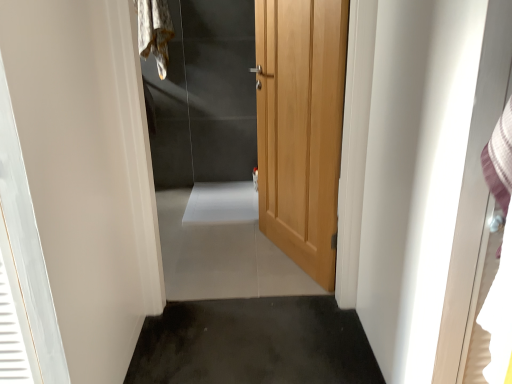
Question: From the image's perspective, is wooden door at center above or below light wood door at center?

Choices:
 (A) above
 (B) below

Answer: (B)

Question: In the image, is wooden door at center on the left side or the right side of light wood door at center?

Choices:
 (A) right
 (B) left

Answer: (B)

Question: Estimate the real-world distances between objects in this image. Which object is farther from the white glossy screen door at right?

Choices:
 (A) dark gray concrete at lower center
 (B) wooden door at center
 (C) fuzzy fabric laundry at upper left
 (D) light wood door at center

Answer: (C)

Question: Which object is positioned farthest from the dark gray concrete at lower center?

Choices:
 (A) wooden door at center
 (B) fuzzy fabric laundry at upper left
 (C) light wood door at center
 (D) white glossy screen door at right

Answer: (B)